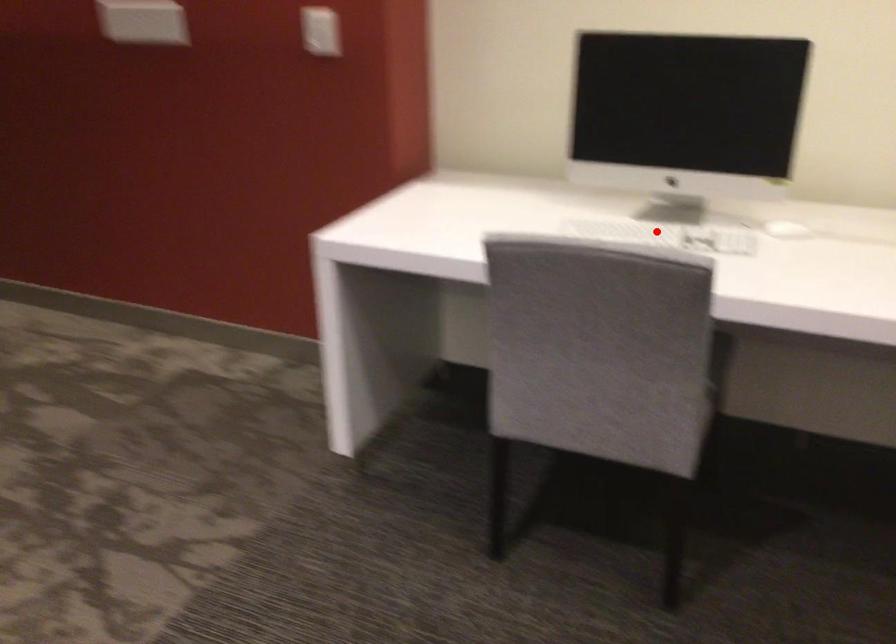
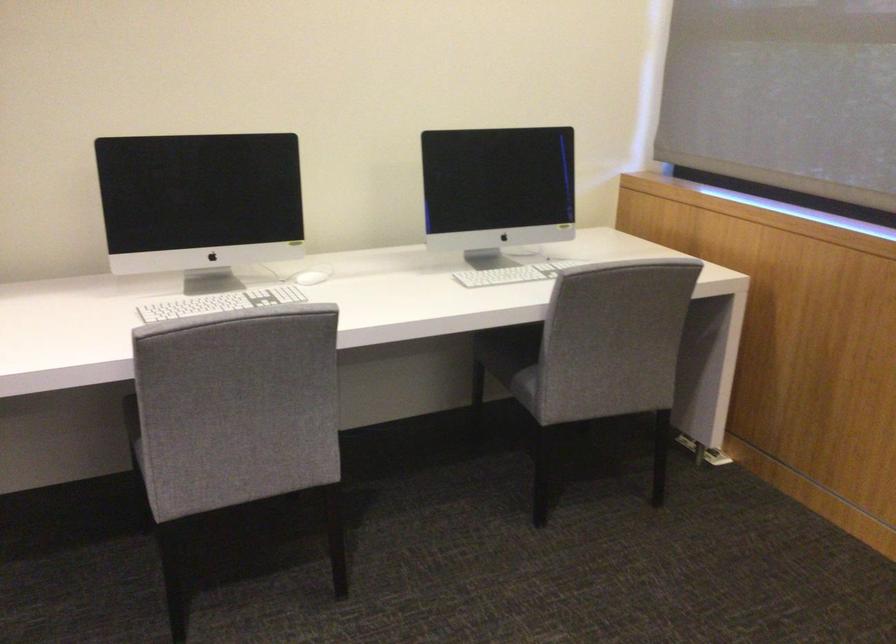
Find the pixel in the second image that matches the highlighted location in the first image.

(220, 303)